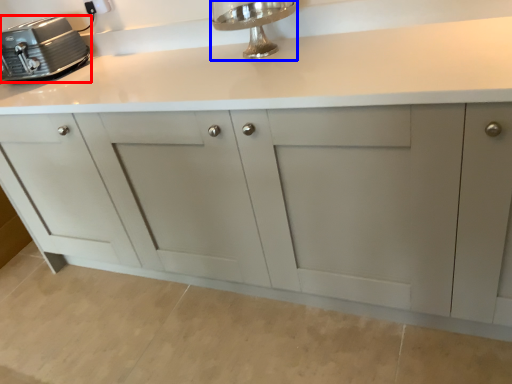
Question: Among these objects, which one is nearest to the camera, home appliance (highlighted by a red box) or faucet (highlighted by a blue box)?

Choices:
 (A) home appliance
 (B) faucet

Answer: (B)